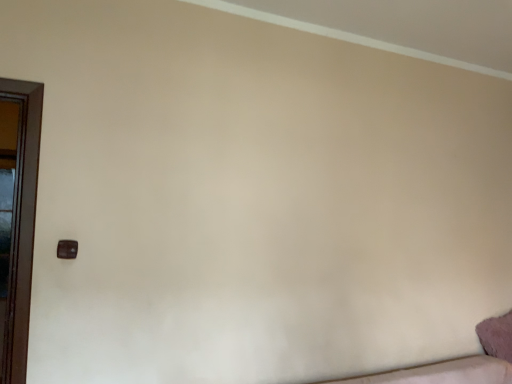
Question: In terms of size, does matte brown door handle at lower left appear bigger or smaller than fuzzy pink pillow at lower right?

Choices:
 (A) small
 (B) big

Answer: (A)

Question: Considering the positions of matte brown door handle at lower left and fuzzy pink pillow at lower right in the image, is matte brown door handle at lower left taller or shorter than fuzzy pink pillow at lower right?

Choices:
 (A) tall
 (B) short

Answer: (B)

Question: Is matte brown door handle at lower left to the left or to the right of fuzzy pink pillow at lower right in the image?

Choices:
 (A) left
 (B) right

Answer: (A)

Question: Is fuzzy pink pillow at lower right inside the boundaries of matte brown door handle at lower left, or outside?

Choices:
 (A) outside
 (B) inside

Answer: (A)

Question: In terms of size, does fuzzy pink pillow at lower right appear bigger or smaller than matte brown door handle at lower left?

Choices:
 (A) big
 (B) small

Answer: (A)

Question: Is fuzzy pink pillow at lower right taller or shorter than matte brown door handle at lower left?

Choices:
 (A) short
 (B) tall

Answer: (B)

Question: From the image's perspective, is fuzzy pink pillow at lower right located above or below matte brown door handle at lower left?

Choices:
 (A) below
 (B) above

Answer: (A)